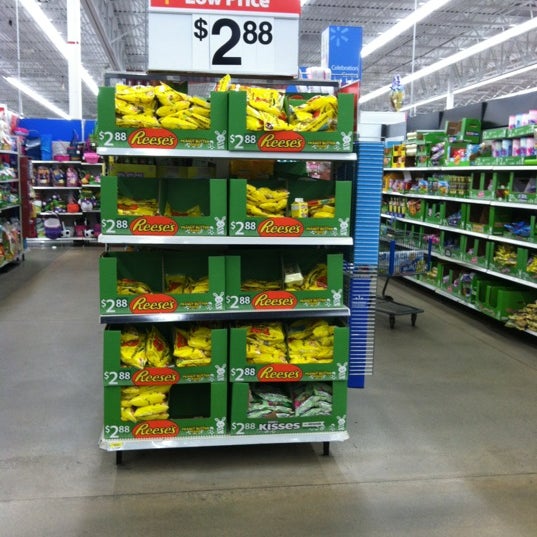
Where is `lights`? Image resolution: width=537 pixels, height=537 pixels. lights is located at coordinates (50, 35), (47, 101), (462, 55), (393, 24), (498, 75).